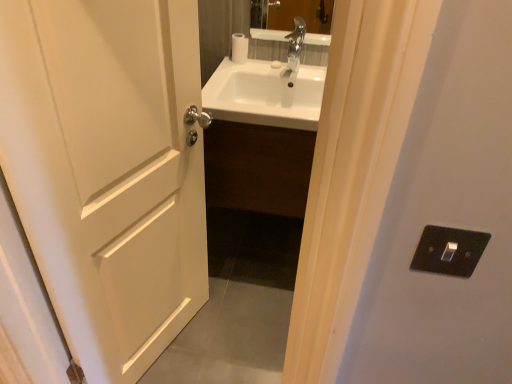
Question: Choose the correct answer: Is black plastic switch at right inside white matte toilet paper at upper center or outside it?

Choices:
 (A) outside
 (B) inside

Answer: (A)

Question: In terms of size, does black plastic switch at right appear bigger or smaller than white matte toilet paper at upper center?

Choices:
 (A) small
 (B) big

Answer: (B)

Question: Considering the real-world distances, which object is farthest from the white matte toilet paper at upper center?

Choices:
 (A) black plastic switch at right
 (B) white matte door at left
 (C) white glossy sink at center

Answer: (A)

Question: Estimate the real-world distances between objects in this image. Which object is farther from the black plastic switch at right?

Choices:
 (A) white matte toilet paper at upper center
 (B) white glossy sink at center
 (C) white matte door at left

Answer: (A)